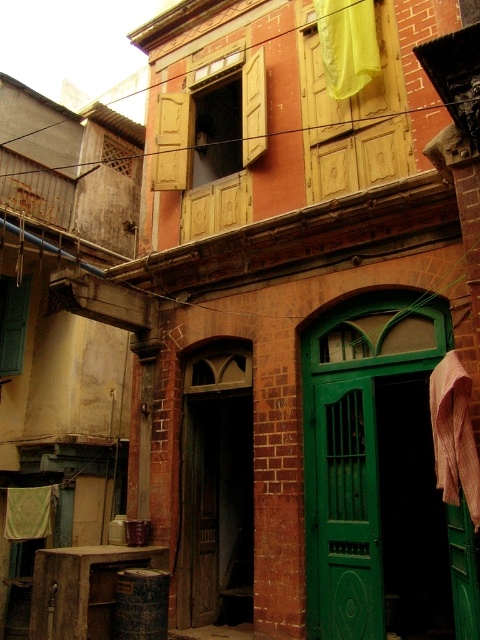
You are standing in front of the building and notice two fabrics. The yellow fabric at upper center and the green fabric laundry at lower left. Which fabric is hanging higher up?

The yellow fabric at upper center is positioned over the green fabric laundry at lower left, so it is hanging higher up.

You are standing in front of the building and want to enter through the wooden door at center. However, there is a brown textured cloth at right nearby. Which object is closer to your current position?

The wooden door at center is closer to your current position because it is to the left of the brown textured cloth at right, meaning it is positioned between you and the cloth.

You are standing in front of the building and want to know how far you are from the point marked at coordinates (343, 550) on the building. Can you determine the distance?

The point at coordinates (343, 550) is 6.05 meters away from you.